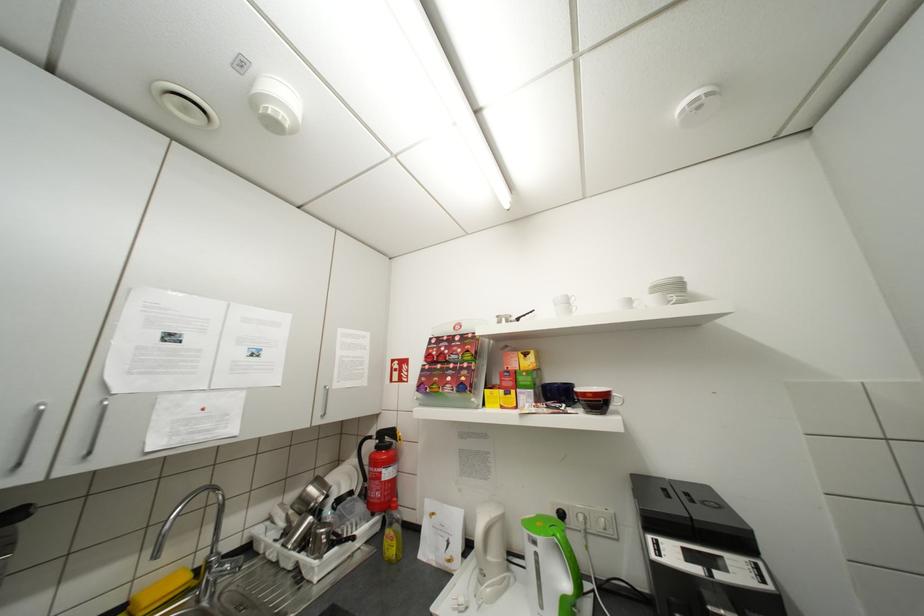
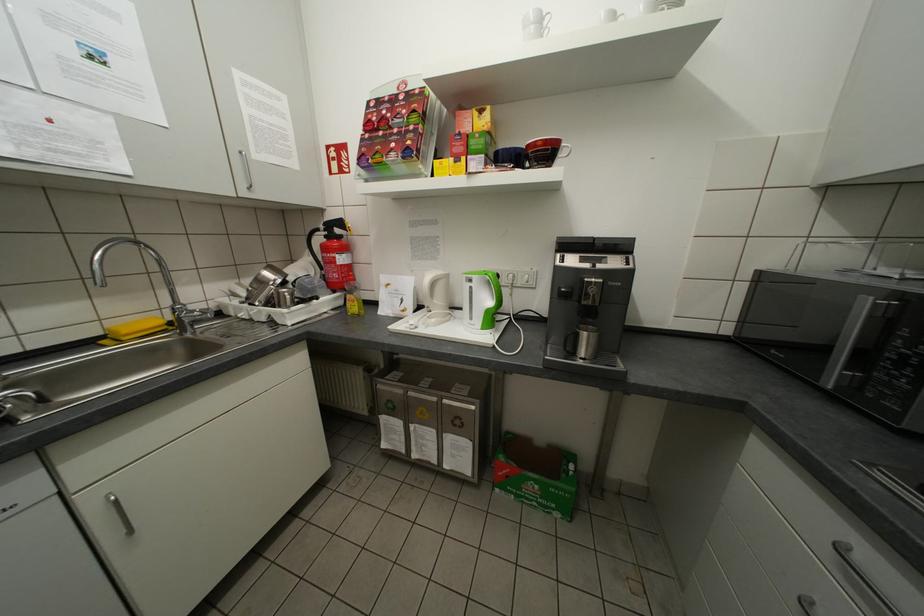
Locate, in the second image, the point that corresponds to pixel 573 406 in the first image.

(521, 166)